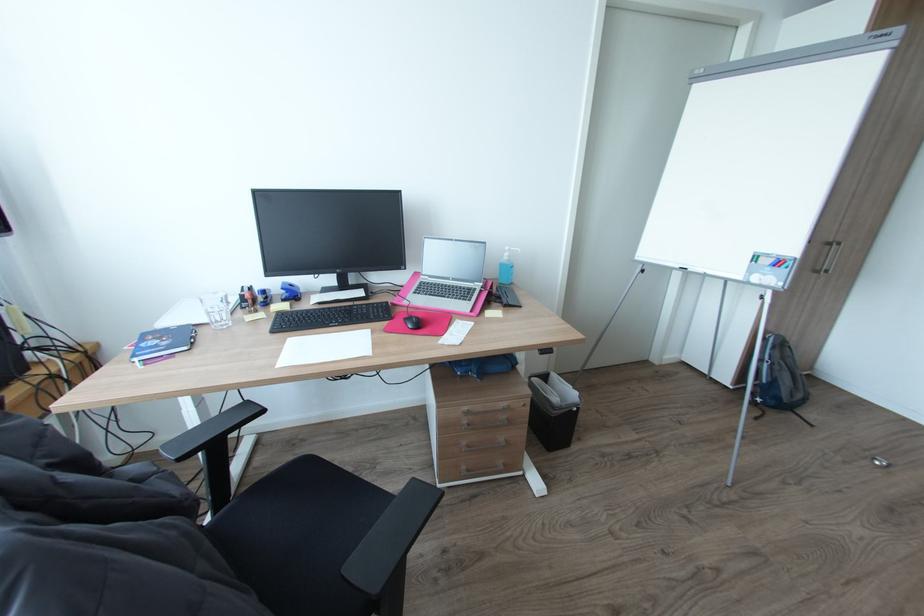
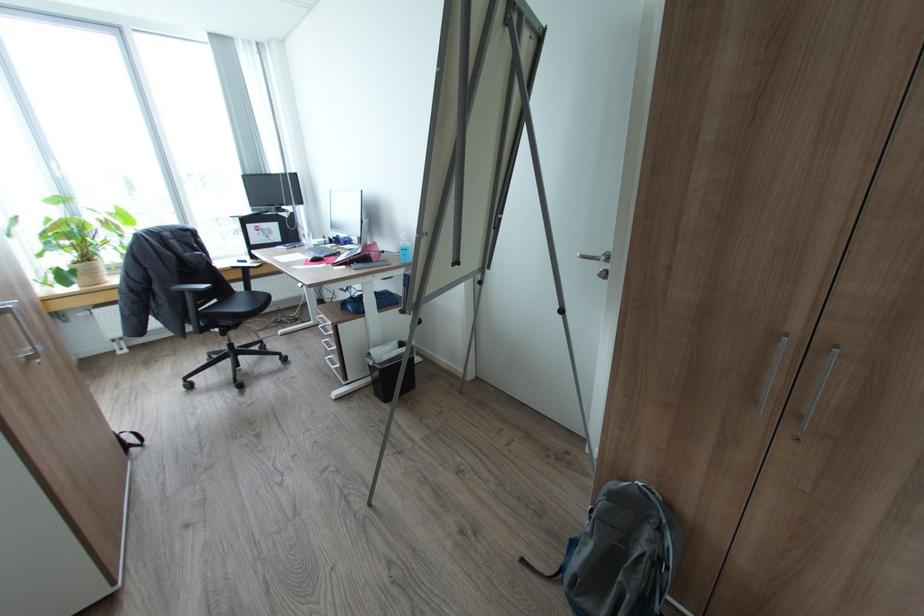
The point at (580, 408) is marked in the first image. Where is the corresponding point in the second image?

(374, 363)